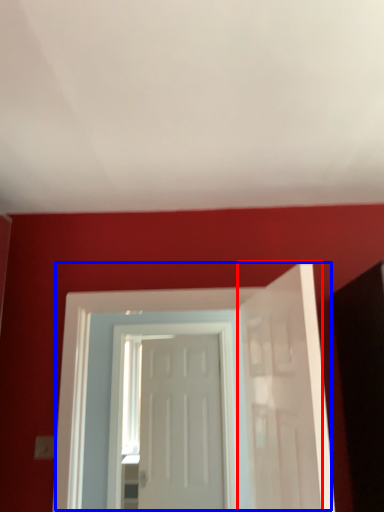
Question: Which object appears closest to the camera in this image, door (highlighted by a red box) or door (highlighted by a blue box)?

Choices:
 (A) door
 (B) door

Answer: (A)